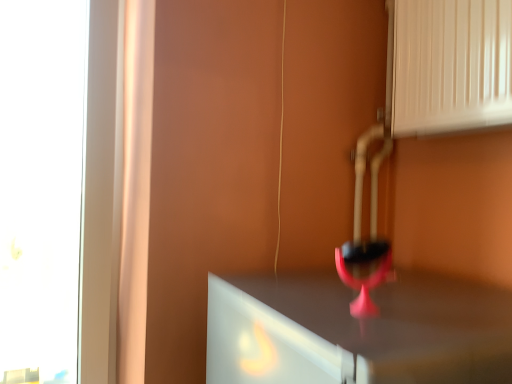
Question: Choose the correct answer: Is white glossy vent at upper right inside pink matte wine glass at center or outside it?

Choices:
 (A) outside
 (B) inside

Answer: (A)

Question: From the image's perspective, is white glossy vent at upper right positioned above or below pink matte wine glass at center?

Choices:
 (A) below
 (B) above

Answer: (B)

Question: Considering the relative positions of white glossy vent at upper right and pink matte wine glass at center in the image provided, is white glossy vent at upper right to the left or to the right of pink matte wine glass at center?

Choices:
 (A) right
 (B) left

Answer: (A)

Question: In the image, is pink matte wine glass at center positioned in front of or behind white glossy vent at upper right?

Choices:
 (A) front
 (B) behind

Answer: (A)

Question: From a real-world perspective, is pink matte wine glass at center physically located above or below white glossy vent at upper right?

Choices:
 (A) above
 (B) below

Answer: (B)

Question: In terms of height, does pink matte wine glass at center look taller or shorter compared to white glossy vent at upper right?

Choices:
 (A) short
 (B) tall

Answer: (A)

Question: Does point (372, 279) appear closer or farther from the camera than point (434, 122)?

Choices:
 (A) closer
 (B) farther

Answer: (A)